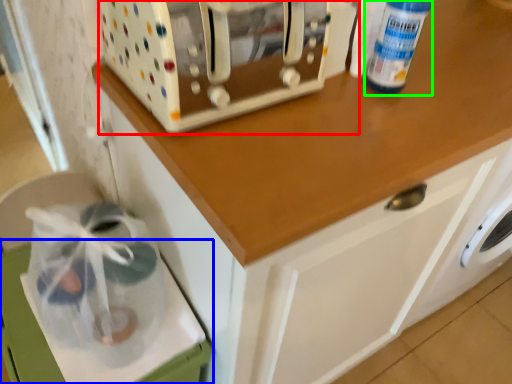
Question: Considering the real-world distances, which object is closest to home appliance (highlighted by a red box)? cabinetry (highlighted by a blue box) or bottle (highlighted by a green box).

Choices:
 (A) cabinetry
 (B) bottle

Answer: (B)